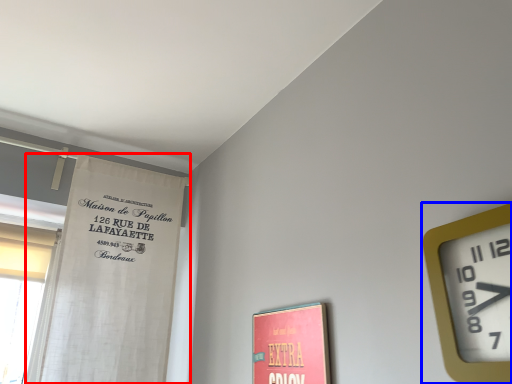
Question: Among these objects, which one is nearest to the camera, curtain (highlighted by a red box) or wall clock (highlighted by a blue box)?

Choices:
 (A) curtain
 (B) wall clock

Answer: (B)